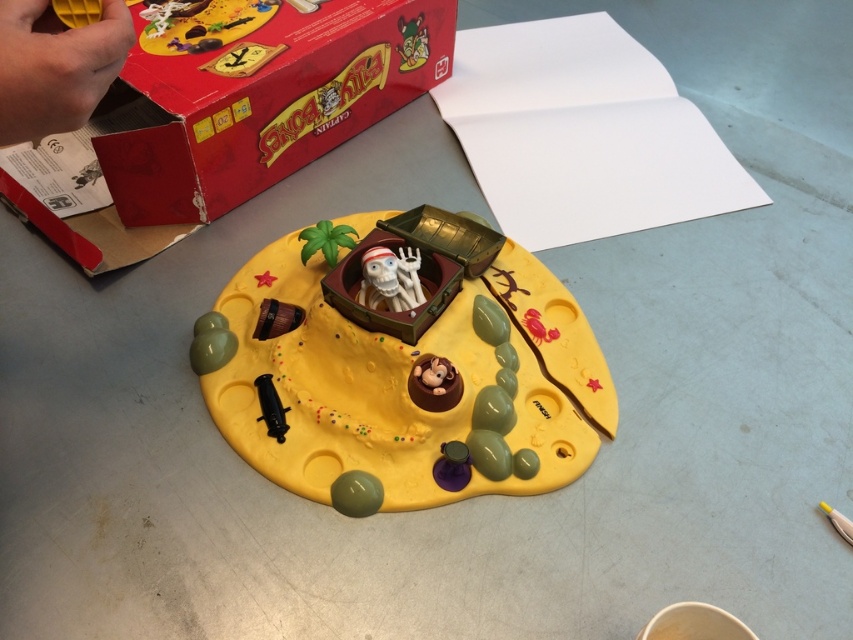
Question: Can you confirm if yellow matte pirate island at center is smaller than matte red box at upper left?

Choices:
 (A) no
 (B) yes

Answer: (B)

Question: Which of the following is the farthest from the observer?

Choices:
 (A) black plastic cannon at lower center
 (B) white matte skeleton at center
 (C) yellow matte hand at upper left

Answer: (A)

Question: Does matte red box at upper left have a larger size compared to black plastic cannon at lower center?

Choices:
 (A) no
 (B) yes

Answer: (B)

Question: Which is nearer to the yellow matte hand at upper left?

Choices:
 (A) brown matte monkey at center
 (B) white matte skeleton at center
 (C) black plastic cannon at lower center

Answer: (B)

Question: Which object appears closest to the camera in this image?

Choices:
 (A) matte red box at upper left
 (B) white matte skeleton at center
 (C) black plastic cannon at lower center
 (D) brown matte monkey at center

Answer: (D)

Question: Is yellow matte pirate island at center behind yellow matte hand at upper left?

Choices:
 (A) no
 (B) yes

Answer: (B)